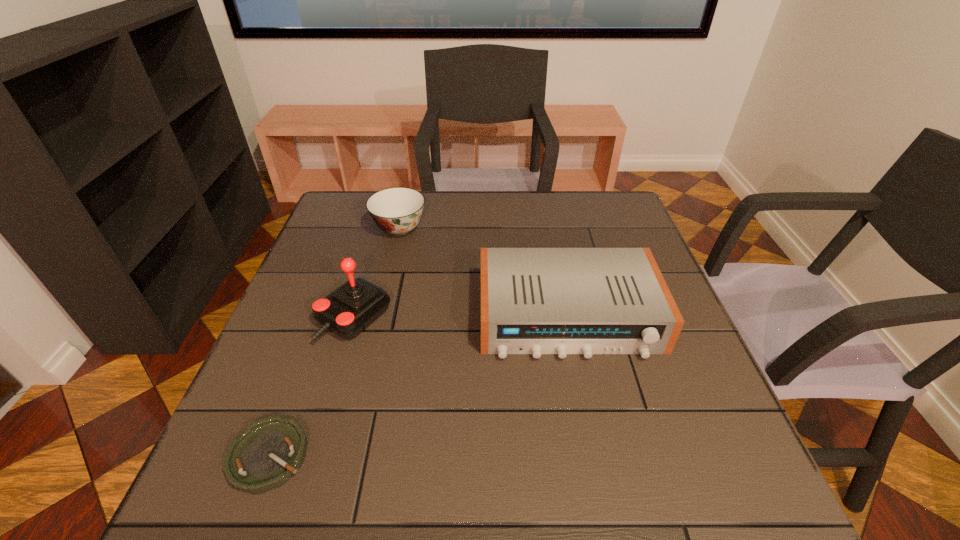
The image size is (960, 540). What are the coordinates of `object at the near edge` in the screenshot? It's located at point(270,451).

Identify the location of joystick positioned at the left edge. Image resolution: width=960 pixels, height=540 pixels. (351, 308).

Find the location of `soup bowl at the left edge`. soup bowl at the left edge is located at coordinates (397, 211).

I want to click on ashtray that is at the left edge, so click(270, 451).

The image size is (960, 540). I want to click on object at the right edge, so click(536, 301).

This screenshot has width=960, height=540. Identify the location of object at the far left corner. (397, 211).

Where is `object located at the near left corner`? Image resolution: width=960 pixels, height=540 pixels. object located at the near left corner is located at coordinates (270, 451).

Where is `free space at the far edge`? This screenshot has height=540, width=960. free space at the far edge is located at coordinates (449, 205).

Locate an element on the screen. The height and width of the screenshot is (540, 960). free location at the left edge of the desktop is located at coordinates (314, 426).

Where is `blank area at the right edge`? blank area at the right edge is located at coordinates (612, 242).